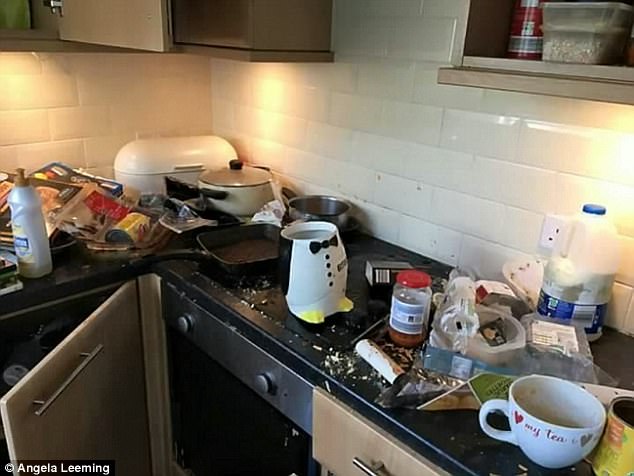
Locate an element on the screen. The width and height of the screenshot is (634, 476). cabinet door is located at coordinates (105, 398).